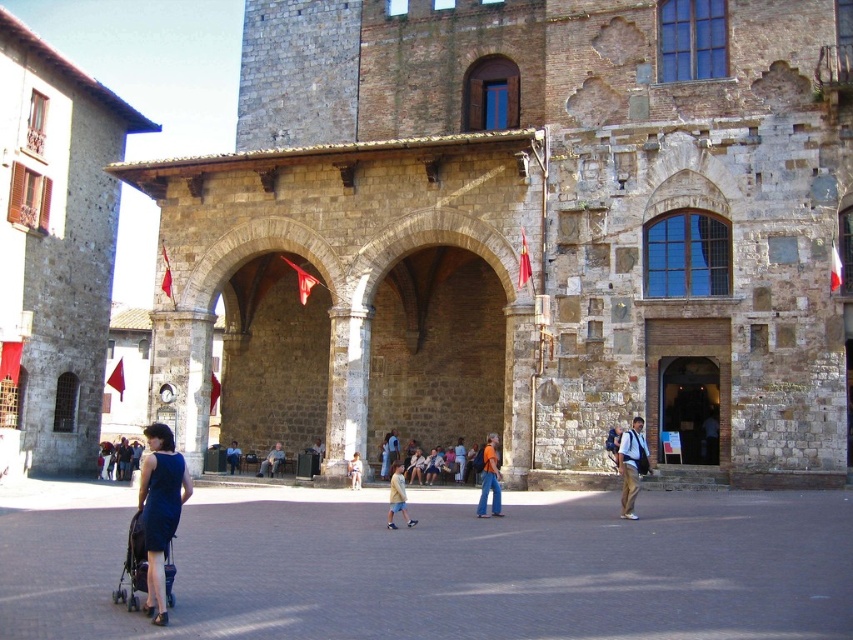
Can you confirm if light yellow cotton shirt at center is positioned above light brown wooden chair at center?

Yes, light yellow cotton shirt at center is above light brown wooden chair at center.

Does point (392, 468) come farther from viewer compared to point (309, 458)?

That is True.

Is point (399, 499) behind point (311, 454)?

No, it is not.

Find the location of `light yellow cotton shirt at center`. light yellow cotton shirt at center is located at coordinates (397, 497).

Between blue denim jeans at center and light brown wooden chair at center, which one appears on the right side from the viewer's perspective?

light brown wooden chair at center

Who is positioned more to the left, blue denim jeans at center or light brown wooden chair at center?

blue denim jeans at center

Which is behind, point (262, 470) or point (308, 472)?

Point (262, 470)

Image resolution: width=853 pixels, height=640 pixels. Identify the location of blue denim jeans at center. (271, 460).

Is light brown wooden chair at center closer to camera compared to light brown wooden bench at center?

Yes, it is.

Based on the photo, between light brown wooden chair at center and light brown wooden bench at center, which one has more height?

light brown wooden bench at center

Describe the element at coordinates (315, 456) in the screenshot. I see `light brown wooden chair at center` at that location.

At what (x,y) coordinates should I click in order to perform the action: click on light brown wooden chair at center. Please return your answer as a coordinate pair (x, y). This screenshot has width=853, height=640. Looking at the image, I should click on (315, 456).